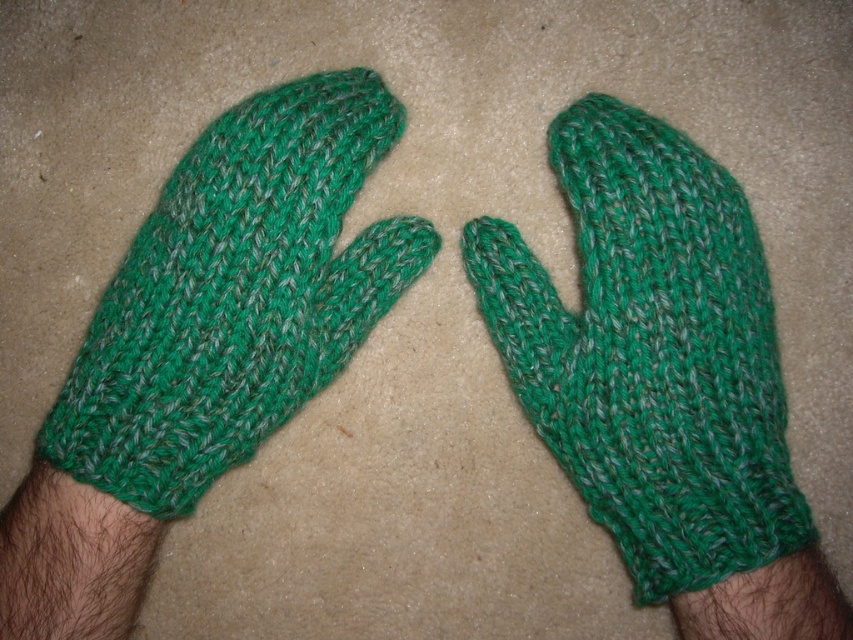
Question: Which of the following is the closest to the observer?

Choices:
 (A) click(x=199, y=401)
 (B) click(x=541, y=436)

Answer: (A)

Question: Is green knitted mitten at center bigger than green knitted mitten at left?

Choices:
 (A) no
 (B) yes

Answer: (B)

Question: Is green knitted mitten at center closer to camera compared to green knitted mitten at left?

Choices:
 (A) no
 (B) yes

Answer: (B)

Question: Is green knitted mitten at center further to camera compared to green knitted mitten at left?

Choices:
 (A) yes
 (B) no

Answer: (B)

Question: Which point appears farthest from the camera in this image?

Choices:
 (A) (318, 241)
 (B) (664, 252)

Answer: (A)